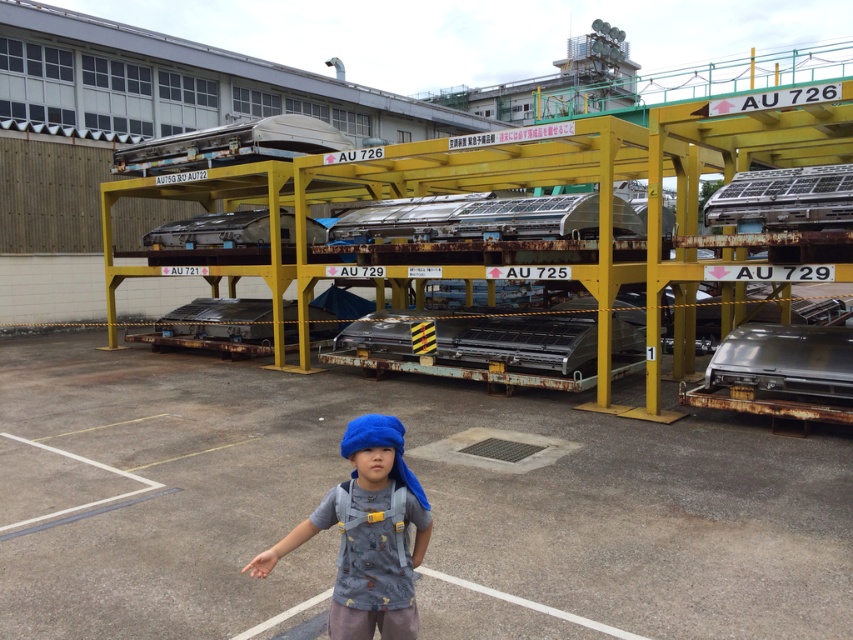
Question: Is blue fabric headband at center above rusty metal car at upper right?

Choices:
 (A) yes
 (B) no

Answer: (B)

Question: Which of the following is the farthest from the observer?

Choices:
 (A) shiny metallic car at right
 (B) rusty metal car at upper right
 (C) rusty metal car at center

Answer: (C)

Question: Which is farther from the gray concrete parking lot at center?

Choices:
 (A) shiny metallic car at right
 (B) rusty metal car at upper right

Answer: (B)

Question: Does gray concrete parking lot at center lie in front of rusty metal car at center?

Choices:
 (A) no
 (B) yes

Answer: (B)

Question: Does gray concrete parking lot at center come behind blue fabric headband at center?

Choices:
 (A) no
 (B) yes

Answer: (B)

Question: Which object is closer to the camera taking this photo?

Choices:
 (A) shiny metallic car at right
 (B) blue fabric headband at center
 (C) rusty metal car at upper right

Answer: (B)